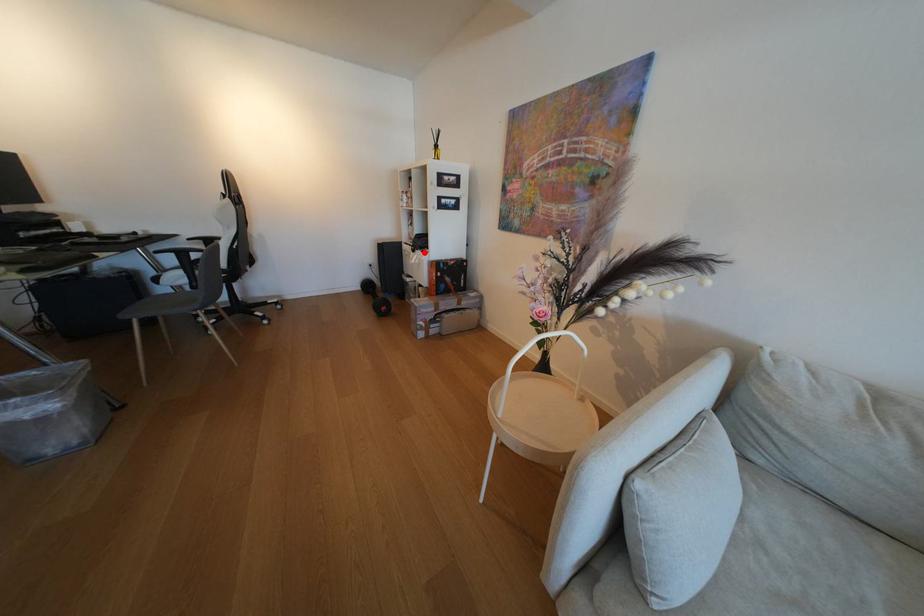
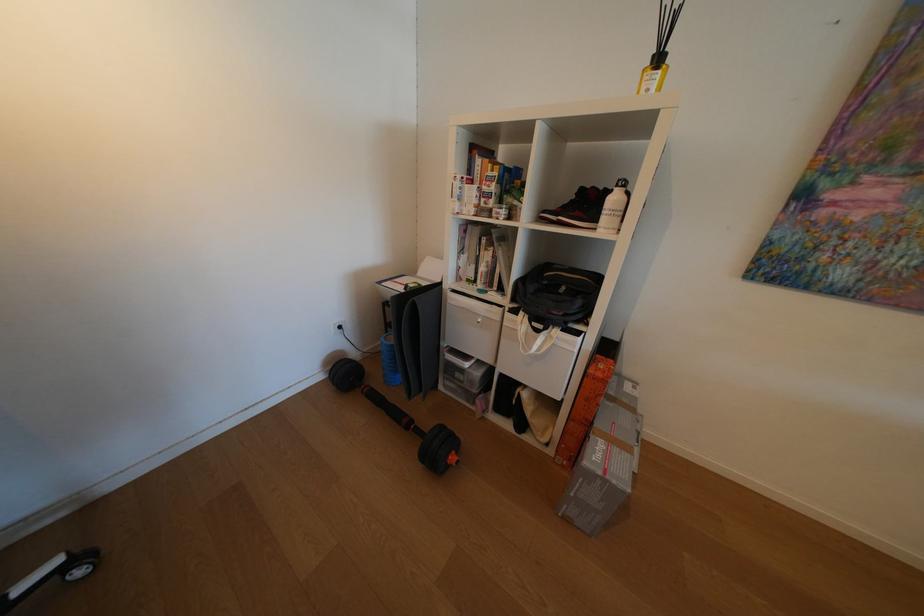
Question: A red point is marked in image1. In image2, is the corresponding 3D point closer to the camera or farther? Reply with the corresponding letter.

Choices:
 (A) The corresponding 3D point is closer.
 (B) The corresponding 3D point is farther.

Answer: (B)